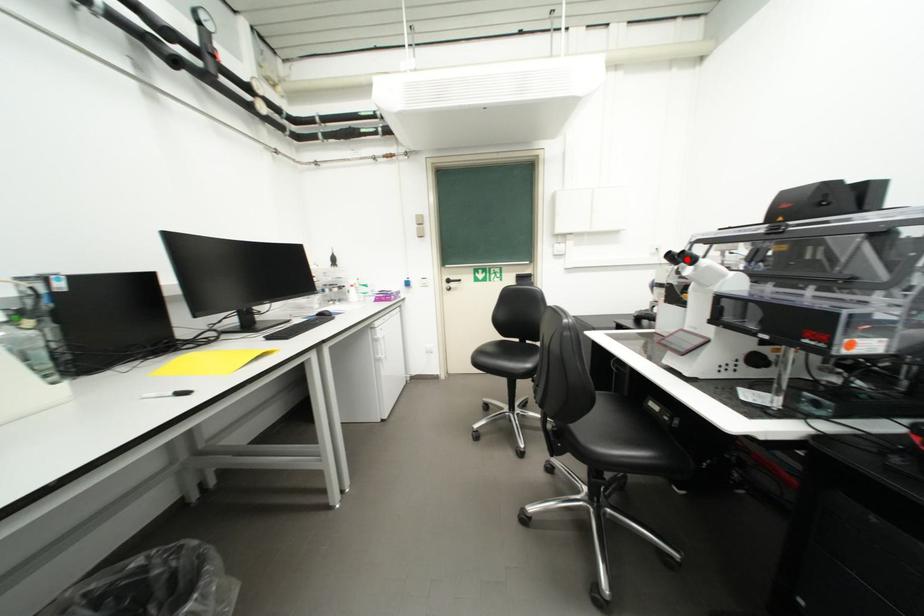
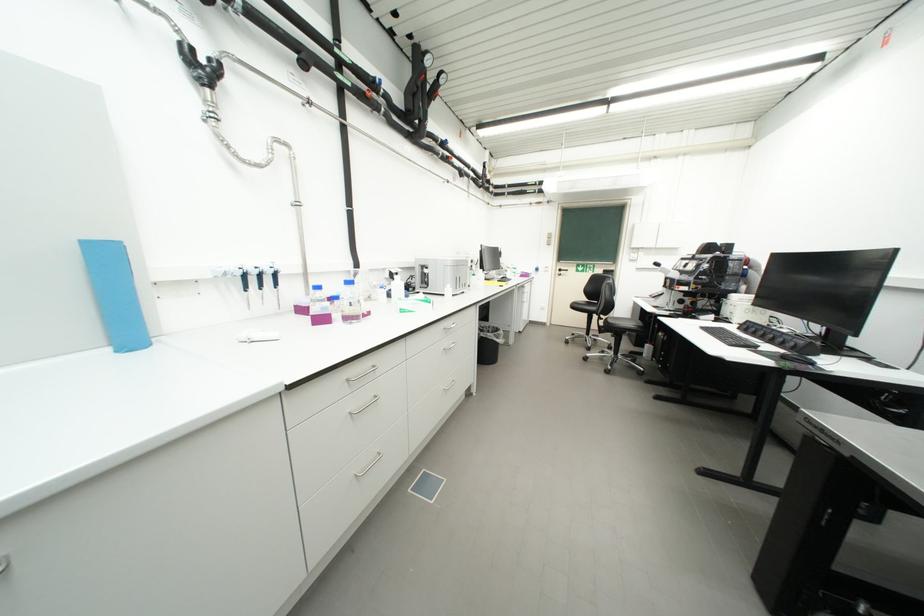
Question: I am providing you with two images of the same scene from different viewpoints. A red point is marked on the first image. At the location where the point appears in image 1, is it still visible in image 2?

Choices:
 (A) Yes
 (B) No

Answer: (B)